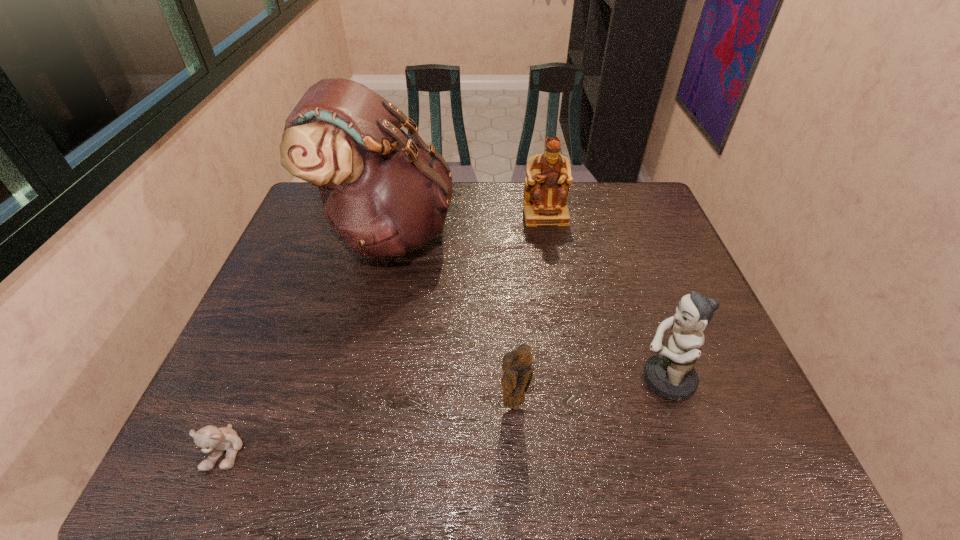
The image size is (960, 540). I want to click on object that is at the far left corner, so click(384, 193).

Locate an element on the screen. This screenshot has width=960, height=540. object that is at the near left corner is located at coordinates (211, 439).

You are a GUI agent. You are given a task and a screenshot of the screen. Output one action in this format:
    pyautogui.click(x=<x>, y=<y>)
    Task: Click on the free location at the far edge
    
    Given the screenshot: What is the action you would take?
    pyautogui.click(x=573, y=220)

Where is `free location at the near edge of the desktop`? free location at the near edge of the desktop is located at coordinates (300, 434).

In the image, there is a desktop. Where is `vacant space at the left edge`? vacant space at the left edge is located at coordinates (312, 224).

You are a GUI agent. You are given a task and a screenshot of the screen. Output one action in this format:
    pyautogui.click(x=<x>, y=<y>)
    Task: Click on the vacant area at the right edge
    
    Given the screenshot: What is the action you would take?
    pyautogui.click(x=697, y=404)

The height and width of the screenshot is (540, 960). What are the coordinates of `vacant region at the near left corner of the desktop` in the screenshot? It's located at (179, 477).

At what (x,y) coordinates should I click in order to perform the action: click on vacant space at the far right corner of the desktop. Please return your answer as a coordinate pair (x, y). This screenshot has width=960, height=540. Looking at the image, I should click on (649, 203).

Locate an element on the screen. free space at the near right corner of the desktop is located at coordinates (740, 473).

Image resolution: width=960 pixels, height=540 pixels. What are the coordinates of `vacant area that lies between the nearest object and the second figurine from right to left` in the screenshot? It's located at (385, 333).